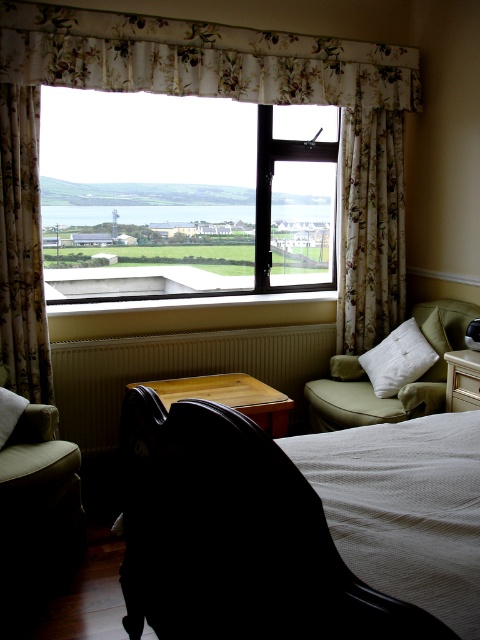
Question: Does floral fabric curtain at left appear under white soft pillow at lower left?

Choices:
 (A) no
 (B) yes

Answer: (A)

Question: Estimate the real-world distances between objects in this image. Which object is closer to the wooden/radiant at lower center?

Choices:
 (A) dark wood chair at center
 (B) floral fabric curtain at upper center
 (C) clear glass window at center

Answer: (B)

Question: Which of the following is the farthest from the observer?

Choices:
 (A) (79, 51)
 (B) (336, 364)
 (C) (232, 353)
 (D) (299, 532)

Answer: (C)

Question: Which point appears closest to the camera in this image?

Choices:
 (A) (84, 424)
 (B) (323, 557)
 (C) (13, 397)

Answer: (B)

Question: Can you confirm if leather couch at lower left is wider than white soft cushion at right?

Choices:
 (A) yes
 (B) no

Answer: (B)

Question: Is leather couch at lower left thinner than white soft cushion at right?

Choices:
 (A) yes
 (B) no

Answer: (A)